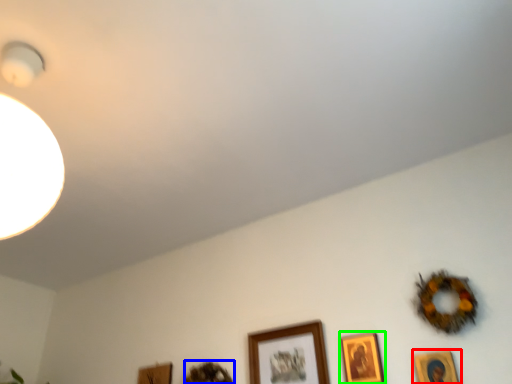
Question: Estimate the real-world distances between objects in this image. Which object is farther from picture frame (highlighted by a red box), picture frame (highlighted by a blue box) or picture frame (highlighted by a green box)?

Choices:
 (A) picture frame
 (B) picture frame

Answer: (A)